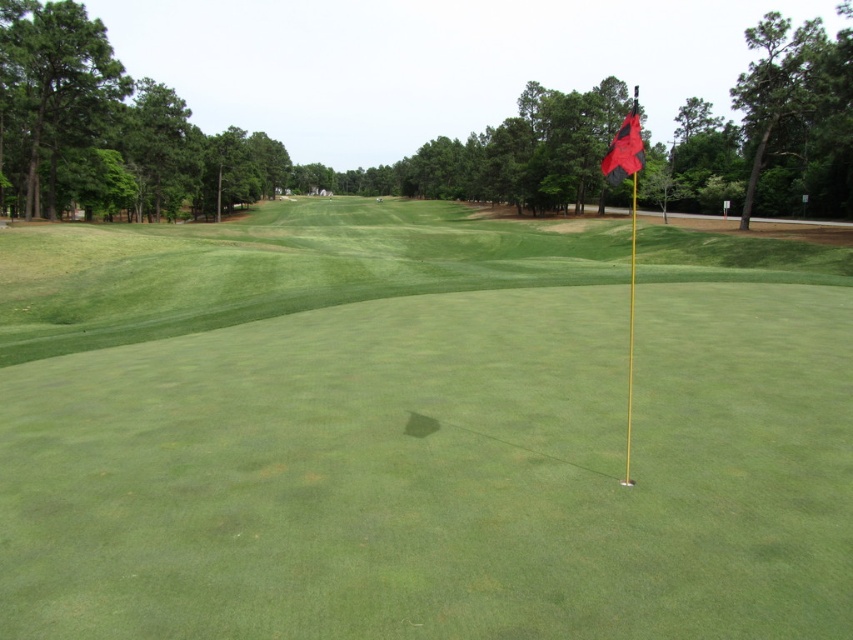
You are a golfer standing on the green grass at center. You want to hit your ball towards the hole marked by the red fabric flag at upper right. Will your ball roll towards the flag if you hit it straight ahead?

Yes, the green grass at center is positioned under the red fabric flag at upper right, so hitting straight ahead will send the ball toward the flag.

From the picture: You are a golfer standing at the tee and want to hit the ball to the green grass at center. Based on the coordinates provided, in which direction should you aim your shot relative to the yellow flagpole on the right?

The green grass at center is located at coordinates 0.672 on the x and 0.494 on the y. Since the yellow flagpole is on the right side of the frame, the green grass at center is to the left of the flagpole. Therefore, you should aim your shot to the left of the yellow flagpole on the right to reach the green grass at center.

You are a golfer standing at the point marked by the coordinate point at point (808, 461). You want to hit a ball to the hole indicated by the yellow flagpole. The flagpole is 6.62 meters away from your position. What is the minimum distance you need to hit the ball to reach the hole?

The minimum distance you need to hit the ball is 6.62 meters, as the flagpole is exactly 6.62 meters away from the point (808, 461).